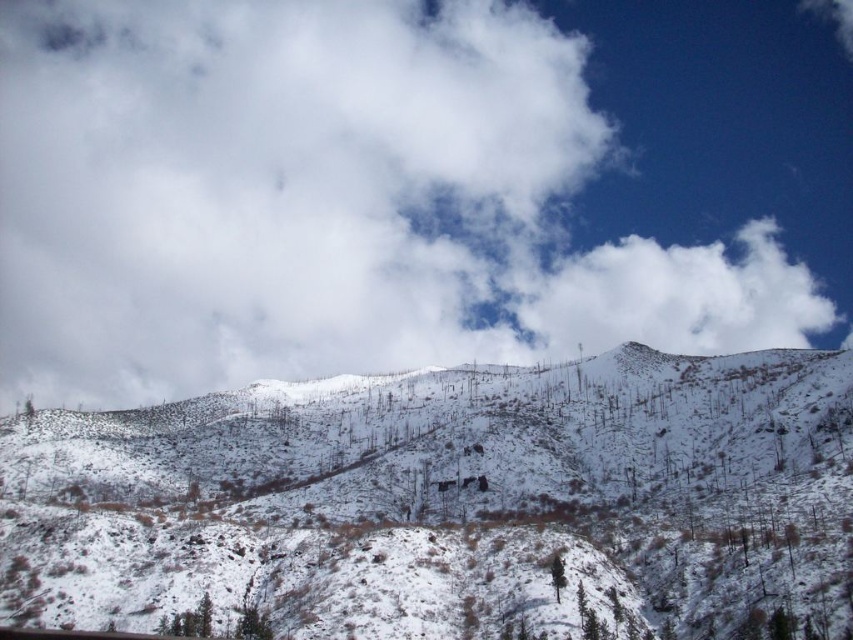
Looking at this image, you are a hiker planning to traverse this mountainous terrain. You have two points marked on your map at coordinates point (834, 448) and point (587, 339). Which point would you encounter first while moving from the base to the summit?

Point (834, 448) is in front of point (587, 339), so you would encounter point (834, 448) first while moving from the base to the summit.

You are an airplane pilot flying at an altitude where you can see the white fluffy cloud at upper center and the white fluffy cloud at upper right. Which cloud is higher in the sky?

The white fluffy cloud at upper center is taller than the white fluffy cloud at upper right, so the white fluffy cloud at upper center is higher in the sky.